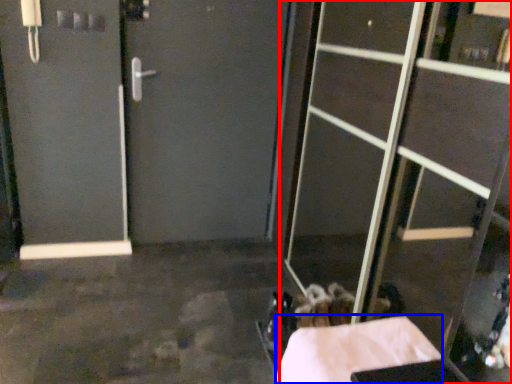
Question: Which object appears farthest to the camera in this image, glass door (highlighted by a red box) or concrete (highlighted by a blue box)?

Choices:
 (A) glass door
 (B) concrete

Answer: (B)